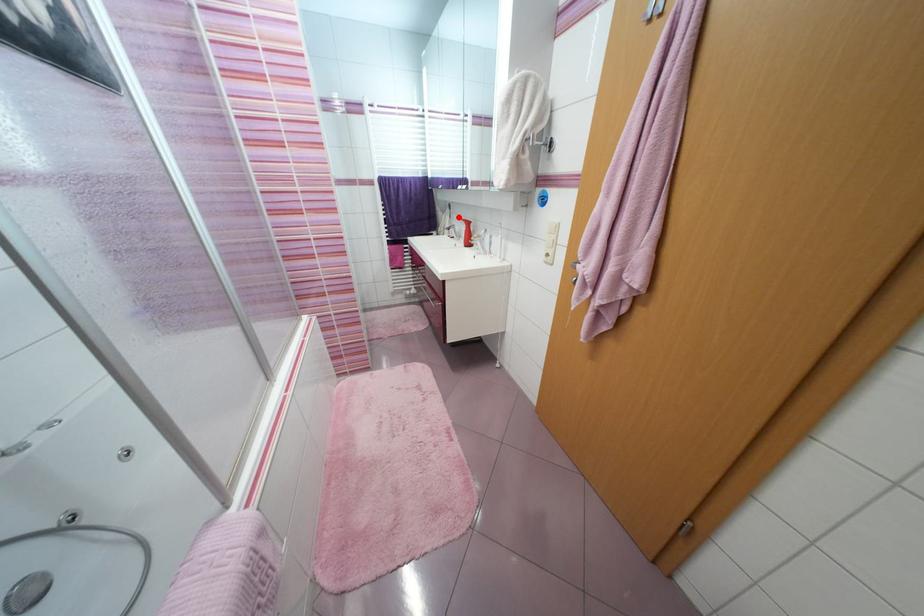
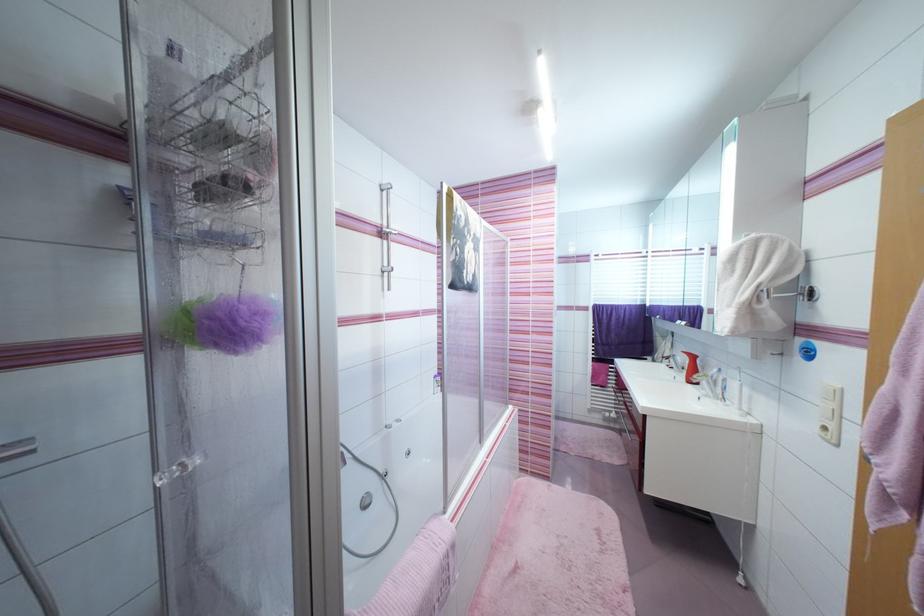
Question: I am providing you with two images of the same scene from different viewpoints. In image1, a red point is highlighted. Considering the same 3D point in image2, which of the following is correct?

Choices:
 (A) It is closer
 (B) It is farther

Answer: (B)